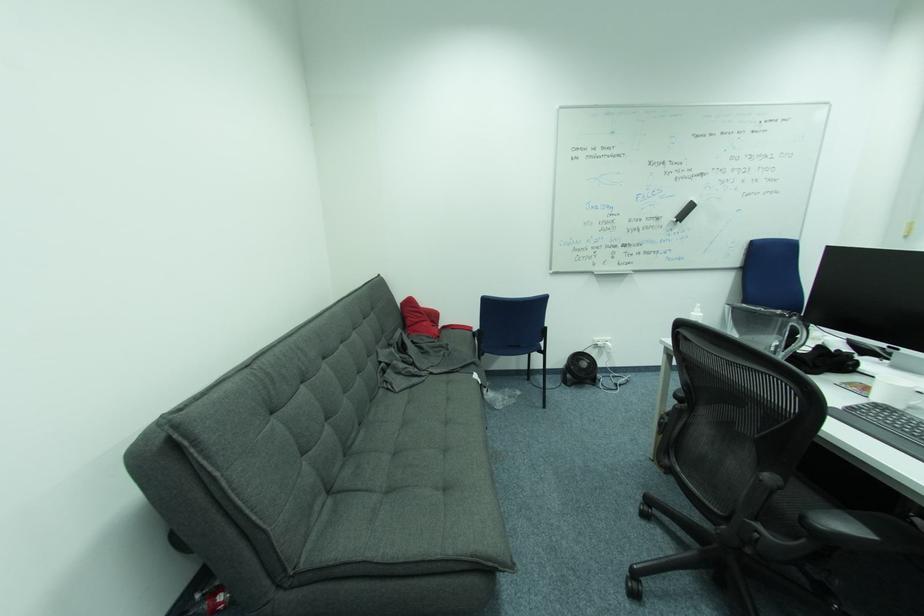
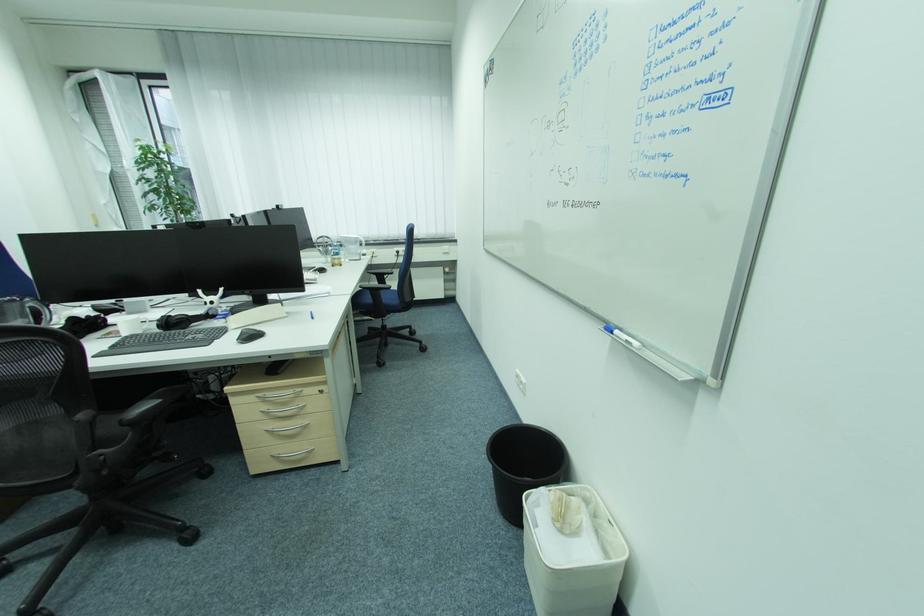
Find the pixel in the second image that matches the point at 809,517 in the first image.

(128, 422)